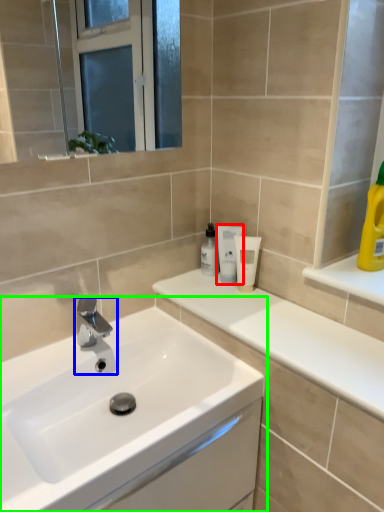
Question: Estimate the real-world distances between objects in this image. Which object is closer to mouthwash (highlighted by a red box), tap (highlighted by a blue box) or sink (highlighted by a green box)?

Choices:
 (A) tap
 (B) sink

Answer: (A)